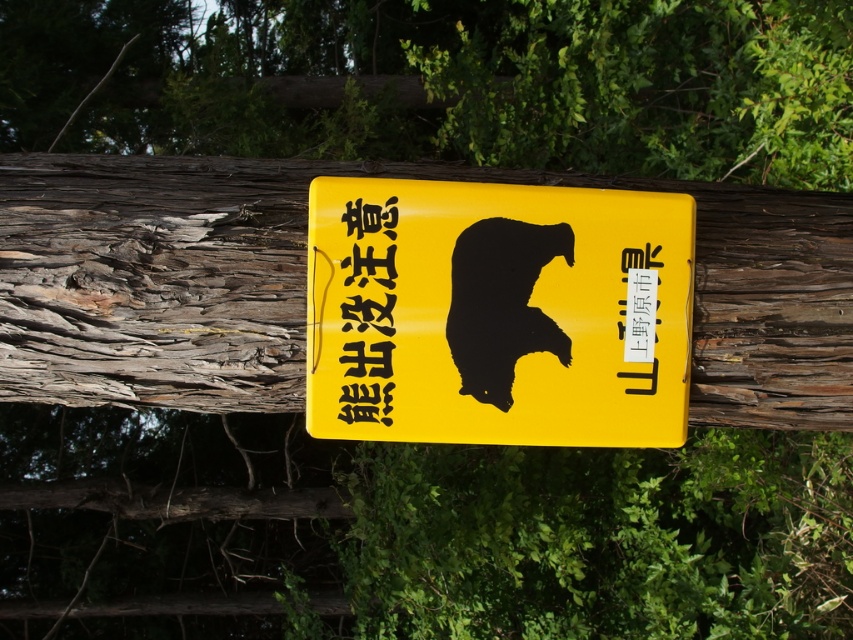
Question: Which point is farther from the camera taking this photo?

Choices:
 (A) (593, 268)
 (B) (225, 243)
 (C) (393, 278)

Answer: (B)

Question: Does yellow matte signboard at center appear on the right side of yellow paper at center?

Choices:
 (A) yes
 (B) no

Answer: (A)

Question: Which point is farther to the camera?

Choices:
 (A) yellow paper at center
 (B) yellow matte signboard at center

Answer: (B)

Question: Is rough bark tree trunk at center smaller than yellow paper at center?

Choices:
 (A) yes
 (B) no

Answer: (B)

Question: Which object is positioned farthest from the rough bark tree trunk at center?

Choices:
 (A) yellow paper at center
 (B) yellow matte signboard at center

Answer: (A)

Question: Is rough bark tree trunk at center wider than yellow paper at center?

Choices:
 (A) yes
 (B) no

Answer: (A)